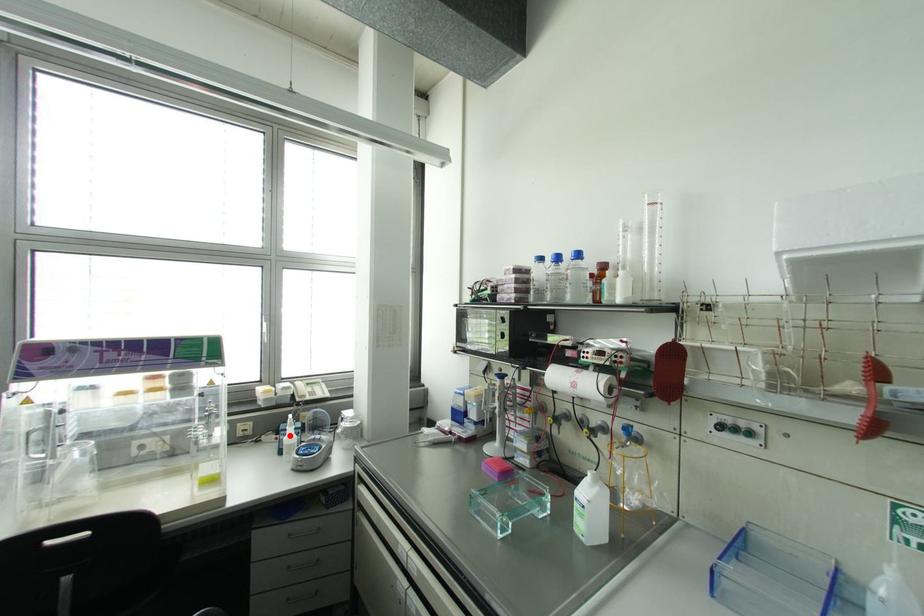
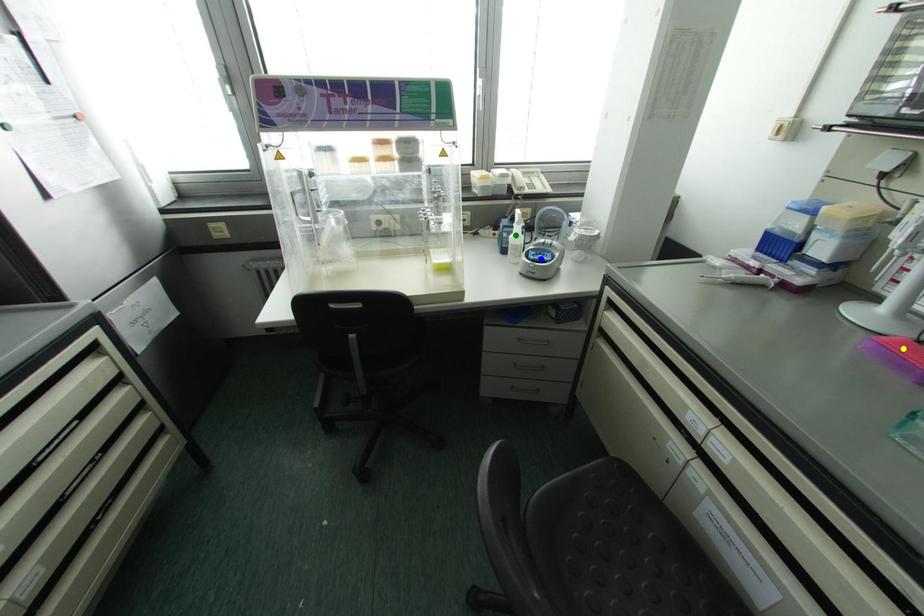
Question: I am providing you with two images of the same scene from different viewpoints. A red point is marked on the first image. You are given multiple points on the second image. Which spot in image 2 lines up with the point in image 1?

Choices:
 (A) green point
 (B) blue point
 (C) yellow point

Answer: (A)